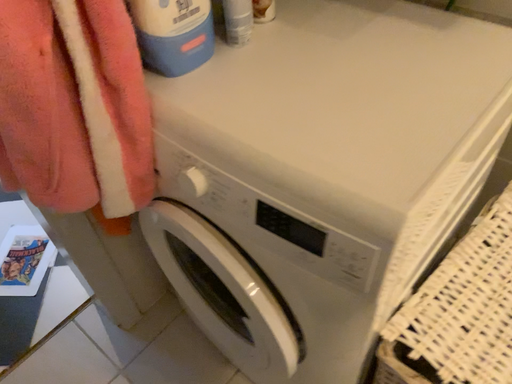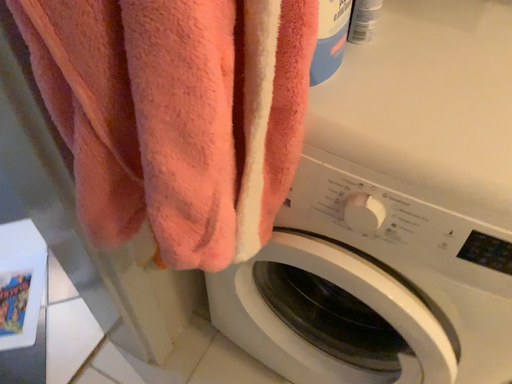
Question: Which way did the camera rotate in the video?

Choices:
 (A) rotated right
 (B) rotated left

Answer: (A)